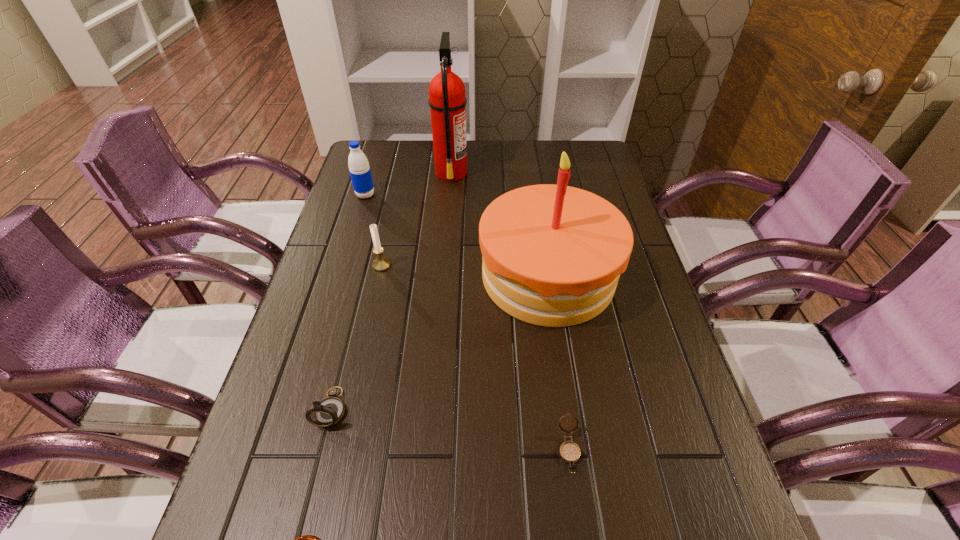
I want to click on the farthest object, so click(447, 101).

This screenshot has height=540, width=960. Find the location of `fire extinguisher`. fire extinguisher is located at coordinates (447, 101).

I want to click on birthday cake, so click(552, 255).

The width and height of the screenshot is (960, 540). I want to click on water bottle, so click(358, 164).

This screenshot has height=540, width=960. What are the coordinates of `the third tallest object` in the screenshot? It's located at (358, 164).

Locate an element on the screen. Image resolution: width=960 pixels, height=540 pixels. candle holder is located at coordinates (380, 264).

Image resolution: width=960 pixels, height=540 pixels. In order to click on the tallest compass in this screenshot , I will do `click(329, 411)`.

Where is `the second tallest compass`? The width and height of the screenshot is (960, 540). the second tallest compass is located at coordinates (569, 451).

The width and height of the screenshot is (960, 540). Identify the location of the rightmost compass. (569, 451).

The image size is (960, 540). Identify the location of vacant space located on the side of the farthest object near the handle. (528, 172).